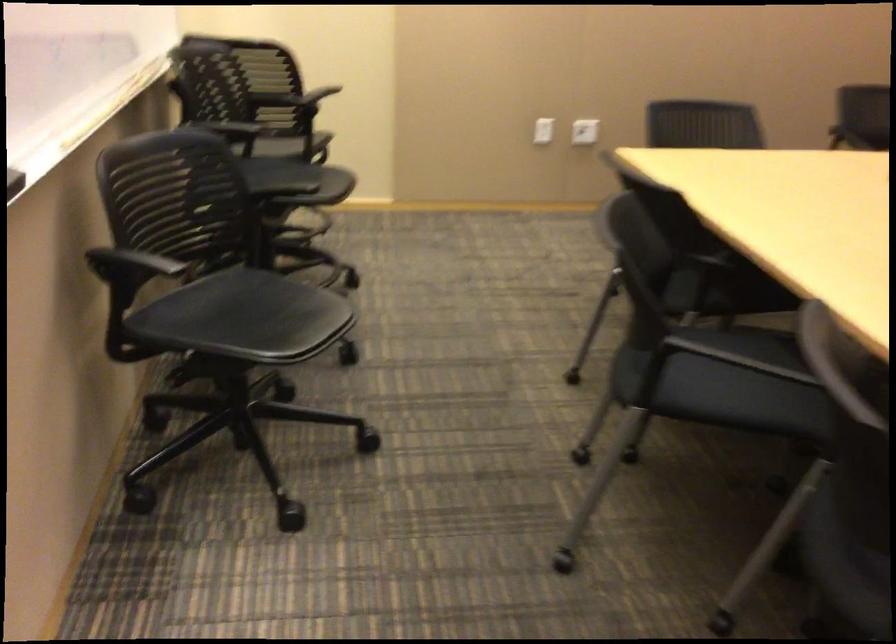
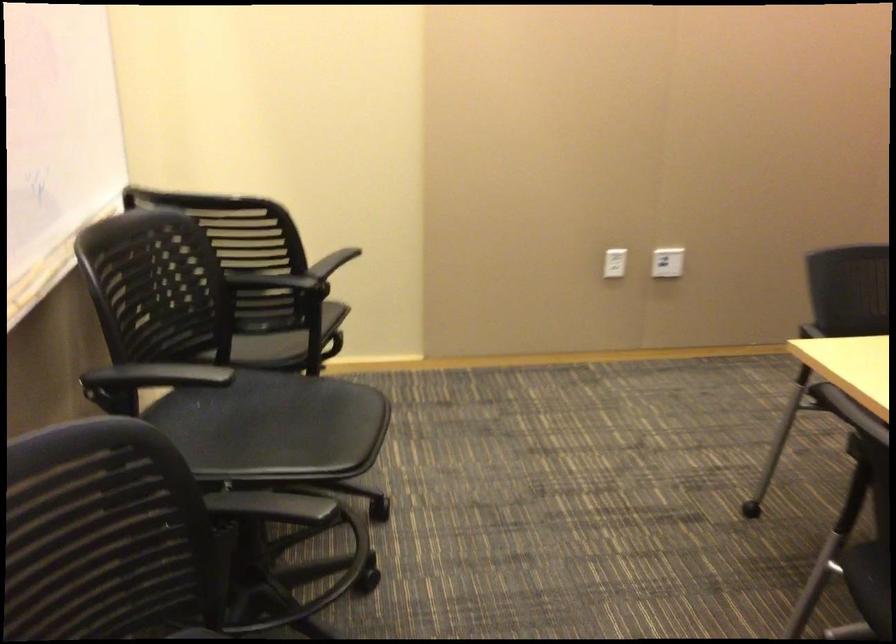
In the second image, find the point that corresponds to the point at 587,131 in the first image.

(667, 261)